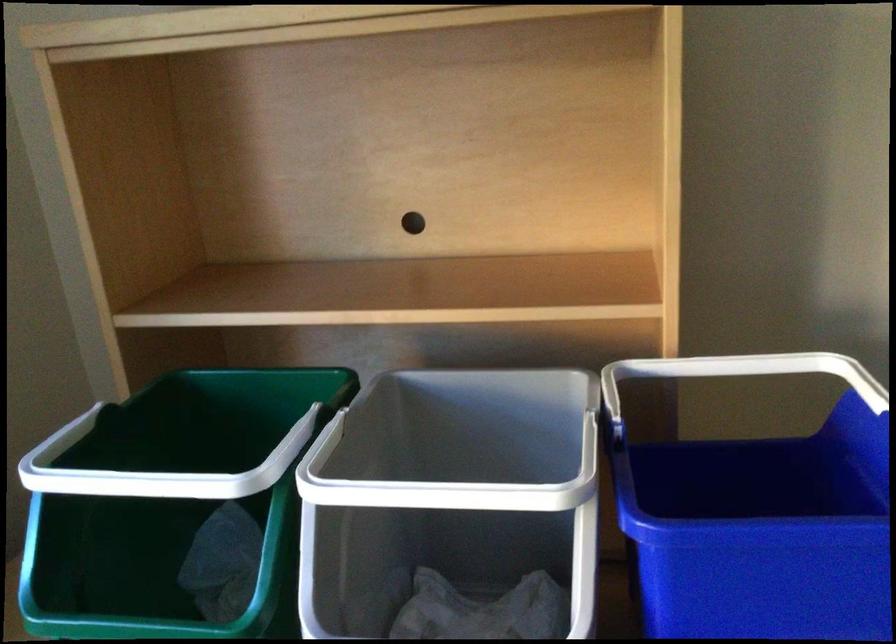
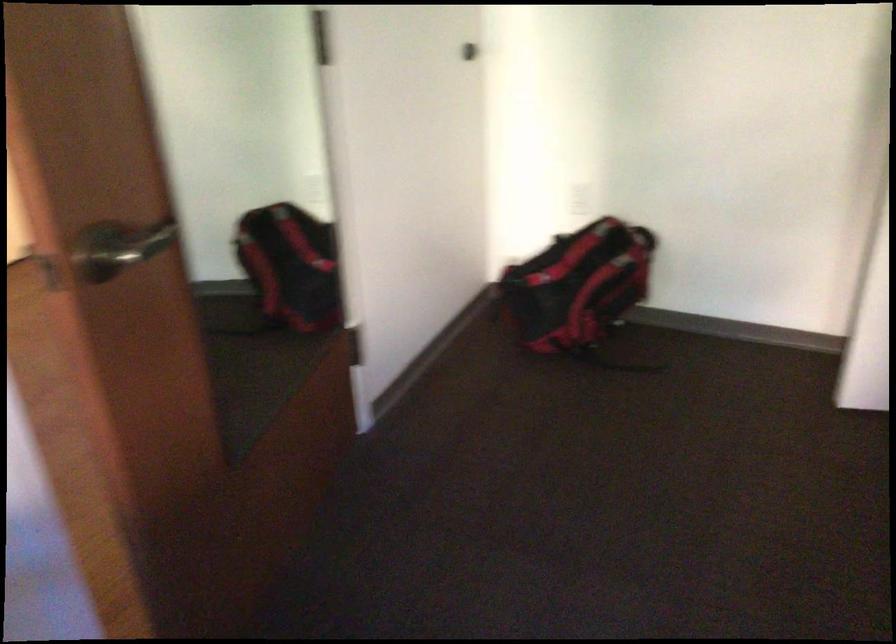
How did the camera likely rotate?

The camera's rotation is toward right-down.